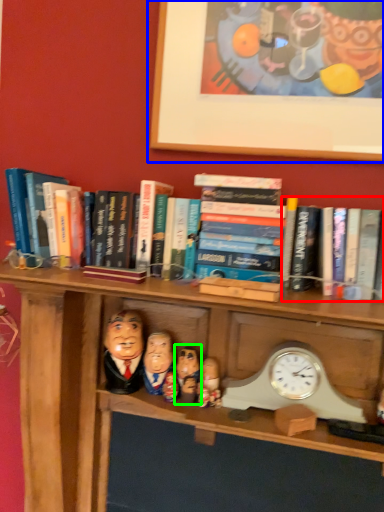
Question: Which object is positioned closest to book (highlighted by a red box)? Select from picture frame (highlighted by a blue box) and person (highlighted by a green box).

Choices:
 (A) picture frame
 (B) person

Answer: (A)